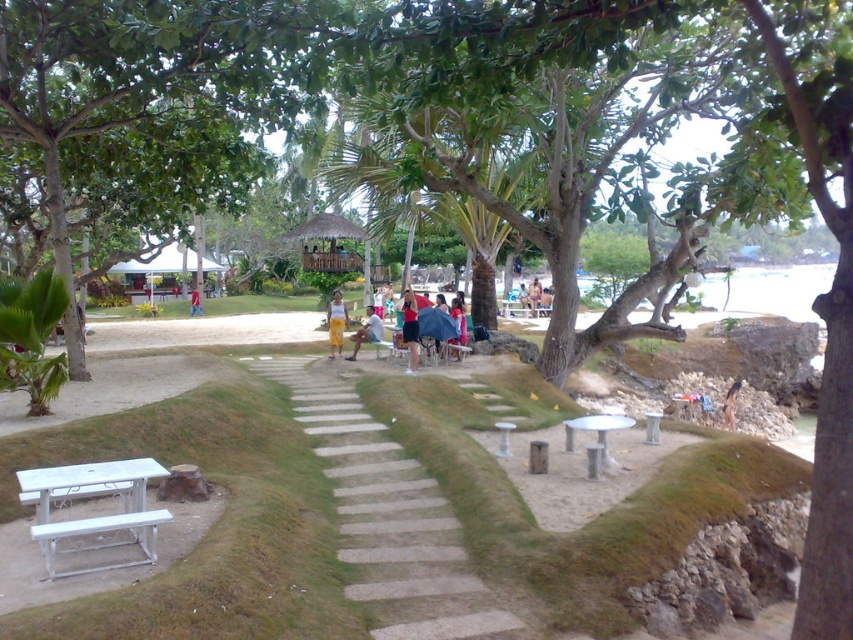
Is light gray concrete steps at center taller than light brown wooden bench at center?

No, light gray concrete steps at center is not taller than light brown wooden bench at center.

Is point (314, 408) positioned after point (531, 291)?

No, (314, 408) is in front of (531, 291).

Image resolution: width=853 pixels, height=640 pixels. What do you see at coordinates (390, 518) in the screenshot?
I see `light gray concrete steps at center` at bounding box center [390, 518].

Locate an element on the screen. This screenshot has width=853, height=640. light gray concrete steps at center is located at coordinates (390, 518).

Is dark blue fabric bikini at lower right in front of red shirt at center?

Yes, dark blue fabric bikini at lower right is closer to the viewer.

Is dark blue fabric bikini at lower right bigger than red shirt at center?

Actually, dark blue fabric bikini at lower right might be smaller than red shirt at center.

Is point (729, 417) positioned before point (199, 305)?

Yes, it is in front of point (199, 305).

I want to click on dark blue fabric bikini at lower right, so click(730, 404).

Between matte pink shirt at center and dark blue fabric bikini at lower right, which one has less height?

dark blue fabric bikini at lower right is shorter.

Is point (413, 360) positioned before point (730, 397)?

Yes, it is in front of point (730, 397).

Between point (415, 337) and point (740, 387), which one is positioned in front?

Point (415, 337) is in front.

Where is `matte pink shirt at center`? This screenshot has height=640, width=853. matte pink shirt at center is located at coordinates (410, 326).